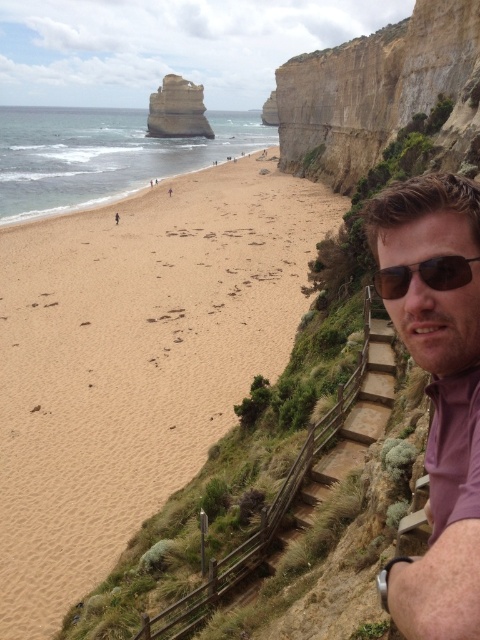
Question: Which of the following is the farthest from the observer?

Choices:
 (A) rustic stone arch at upper center
 (B) cliffy sandstone cliff at upper right
 (C) brown hair at right

Answer: (A)

Question: Which of these objects is positioned closest to the brown sand at lower left?

Choices:
 (A) brown matte sunglasses at right
 (B) cliffy sandstone cliff at upper right

Answer: (B)

Question: Which of the following is the closest to the observer?

Choices:
 (A) cliffy sandstone cliff at upper right
 (B) brown sand at lower left

Answer: (A)

Question: Can you confirm if brown sandy beach at lower left is positioned to the right of rustic stone arch at upper center?

Choices:
 (A) no
 (B) yes

Answer: (B)

Question: Does brown hair at right appear on the right side of brown matte sunglasses at right?

Choices:
 (A) no
 (B) yes

Answer: (B)

Question: Can you confirm if cliffy sandstone cliff at upper right is wider than rustic stone arch at upper center?

Choices:
 (A) yes
 (B) no

Answer: (B)